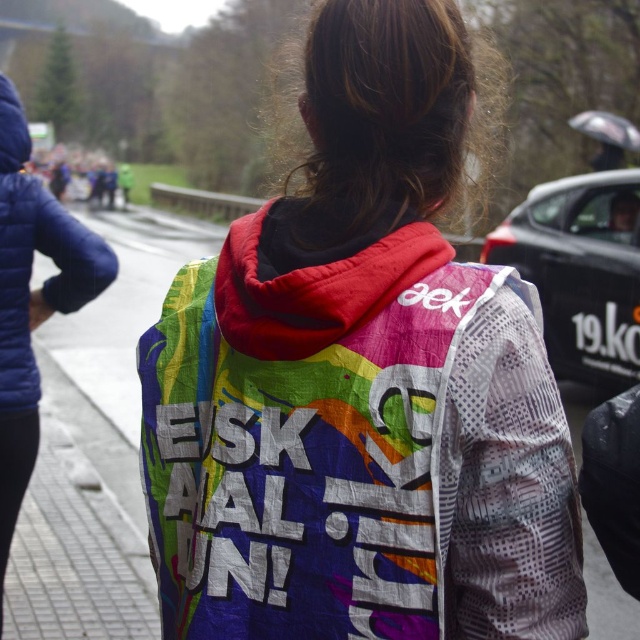
Is point (508, 461) positioned behind point (621, 387)?

No.

Who is lower down, rainbow fabric hoodie at center or black textured car at right?

rainbow fabric hoodie at center

Between point (342, 621) and point (614, 355), which one is positioned behind?

Positioned behind is point (614, 355).

Where is `rainbow fabric hoodie at center`? This screenshot has height=640, width=640. rainbow fabric hoodie at center is located at coordinates (360, 385).

Who is lower down, black textured car at right or rainbow fabric jacket at left?

rainbow fabric jacket at left

Does black textured car at right appear under rainbow fabric jacket at left?

Incorrect, black textured car at right is not positioned below rainbow fabric jacket at left.

Who is more distant from viewer, (618, 300) or (20, 182)?

Positioned behind is point (618, 300).

The height and width of the screenshot is (640, 640). Find the location of `black textured car at right`. black textured car at right is located at coordinates (580, 272).

Is rainbow fabric hoodie at center closer to the viewer compared to rainbow fabric jacket at left?

Yes.

Does rainbow fabric hoodie at center have a greater width compared to rainbow fabric jacket at left?

Indeed, rainbow fabric hoodie at center has a greater width compared to rainbow fabric jacket at left.

Identify the location of rainbow fabric hoodie at center. Image resolution: width=640 pixels, height=640 pixels. (360, 385).